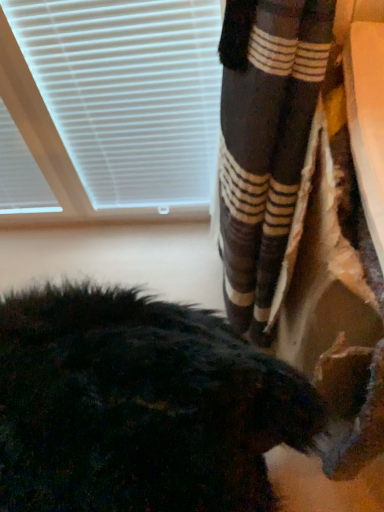
Image resolution: width=384 pixels, height=512 pixels. What do you see at coordinates (129, 93) in the screenshot? I see `white plastic blinds at upper left` at bounding box center [129, 93].

You are a GUI agent. You are given a task and a screenshot of the screen. Output one action in this format:
    pyautogui.click(x=<x>, y=<y>)
    Task: Click on the white plastic blinds at upper left
    
    Given the screenshot: What is the action you would take?
    pyautogui.click(x=129, y=93)

Image resolution: width=384 pixels, height=512 pixels. I want to click on white plastic blinds at upper left, so click(x=129, y=93).